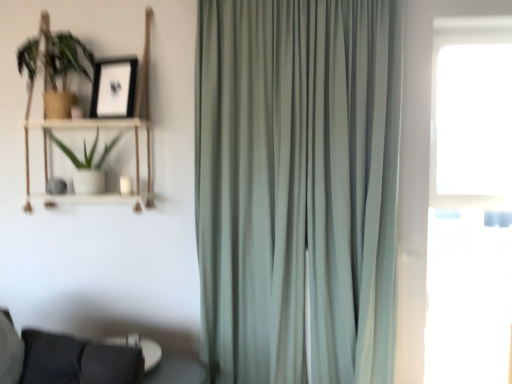
Question: From the image's perspective, relative to satin green curtain at center, is woodenobject at left above or below?

Choices:
 (A) below
 (B) above

Answer: (B)

Question: Is woodenobject at left in front of or behind satin green curtain at center in the image?

Choices:
 (A) behind
 (B) front

Answer: (A)

Question: Which is farther from the green matte plant at upper left, the 2th houseplant ordered from the bottom?

Choices:
 (A) white matte pot at left, marked as the 2th houseplant in a top-to-bottom arrangement
 (B) transparent glass window at right
 (C) satin green curtain at center
 (D) black matte picture frame at upper left
 (E) woodenobject at left

Answer: (B)

Question: Which object is the farthest from the transparent glass window at right?

Choices:
 (A) satin green curtain at center
 (B) green matte plant at upper left, the first houseplant from the top
 (C) black matte picture frame at upper left
 (D) white matte pot at left, marked as the 2th houseplant in a top-to-bottom arrangement
 (E) woodenobject at left

Answer: (B)